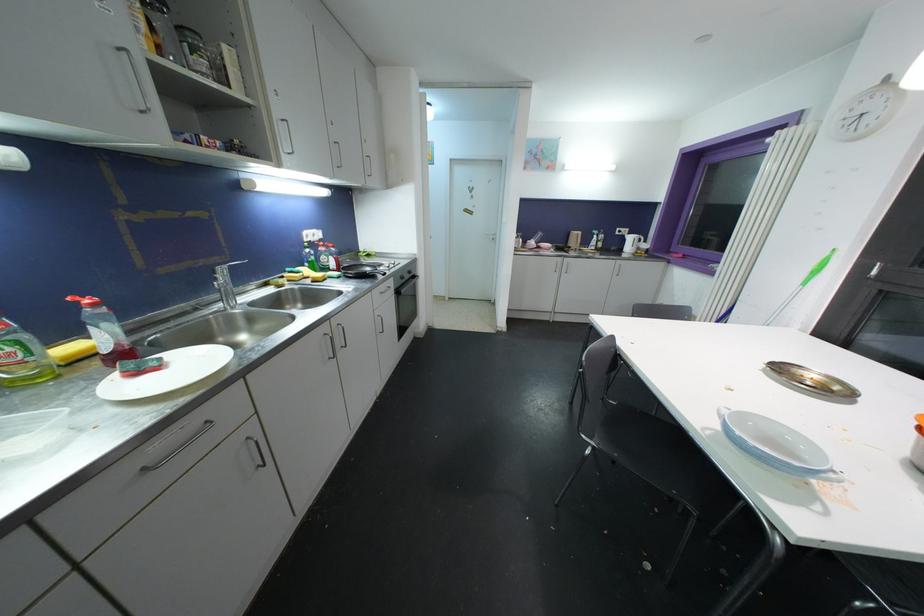
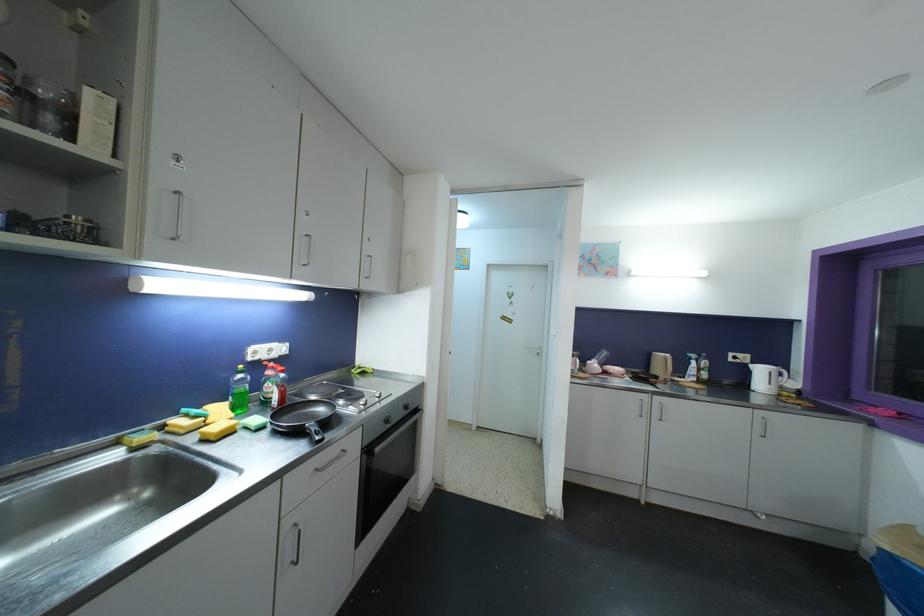
Locate, in the second image, the point that corresponds to (x=406, y=281) in the first image.

(390, 424)